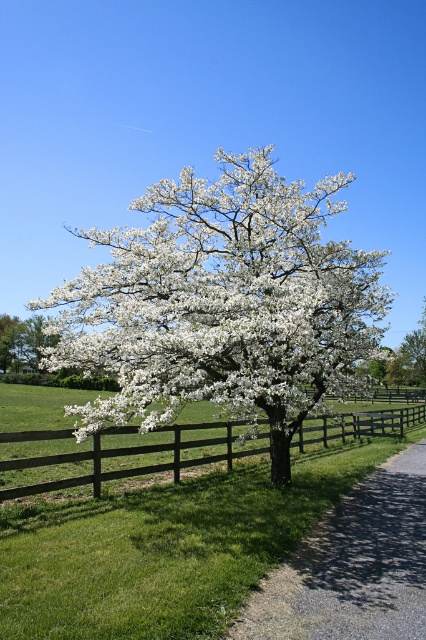
You are standing on the gravel at lower right and want to walk towards the white blossoming tree at center. Which direction should you move to reach it?

You should move downward because the gravel at lower right is located above the white blossoming tree at center, so moving downward will take you towards the tree.

You are a gardener standing at the brown wooden fence at center and want to water the white blossoming tree at center. Given that your watering can has a range of 50 meters, can you reach the tree from your current position?

The brown wooden fence at center and white blossoming tree at center are 53.13 meters apart from each other. Since the watering can only reaches 50 meters, you cannot reach the tree from your current position.